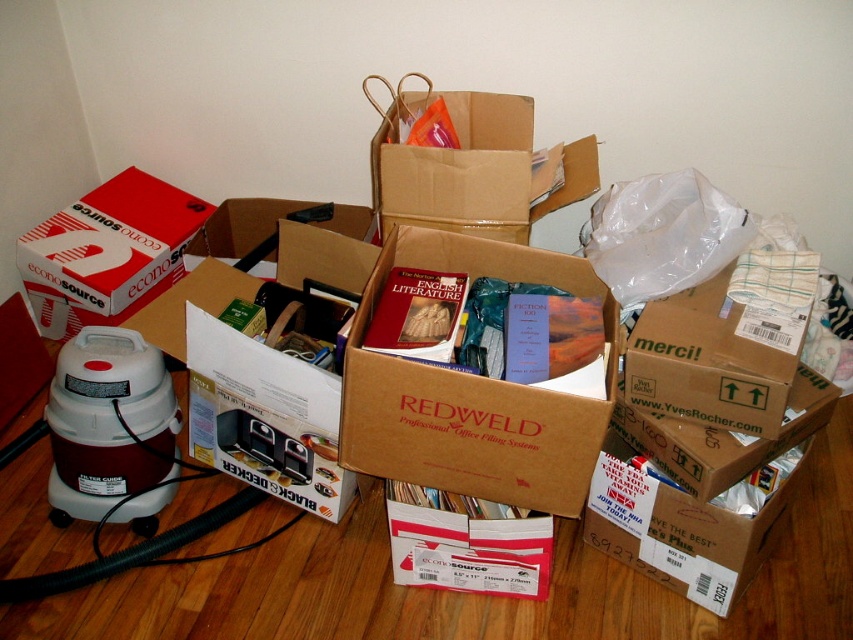
You are organizing items in a storage room and need to move a 36 inch wide desk between the brown cardboard box at center and the red matte cardboard box at left. Can the desk fit through the space between them?

The brown cardboard box at center and the red matte cardboard box at left are 35.26 inches apart from each other. Since the desk is 36 inches wide, it cannot fit through the space between them as the distance is slightly less than the desk width.

You are trying to move a 30 inch long ladder from the brown cardboard box at upper center to the red matte cardboard box at left. Can you fit the ladder through the space between them without bending it?

The distance between the brown cardboard box at upper center and the red matte cardboard box at left is 29.46 inches. Since the ladder is 30 inches long, it cannot fit through the space without bending it.